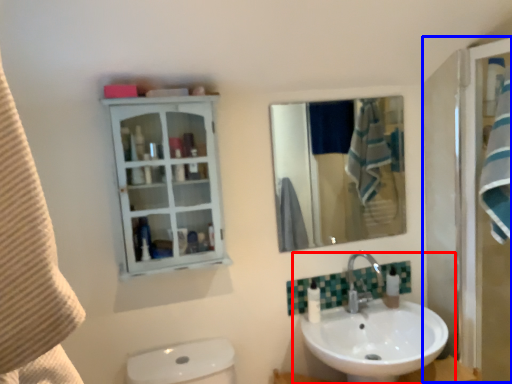
Question: Which object is closer to the camera taking this photo, sink (highlighted by a red box) or screen door (highlighted by a blue box)?

Choices:
 (A) sink
 (B) screen door

Answer: (A)